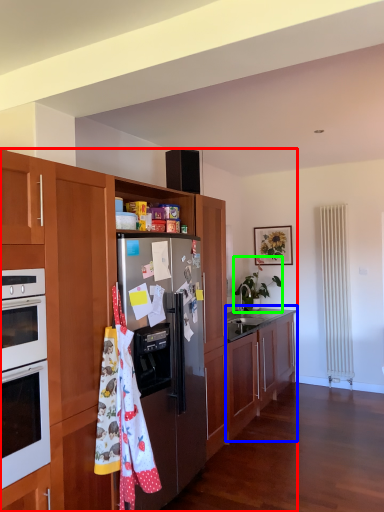
Question: Considering the real-world distances, which object is closest to cabinetry (highlighted by a red box)? cabinetry (highlighted by a blue box) or houseplant (highlighted by a green box).

Choices:
 (A) cabinetry
 (B) houseplant

Answer: (A)